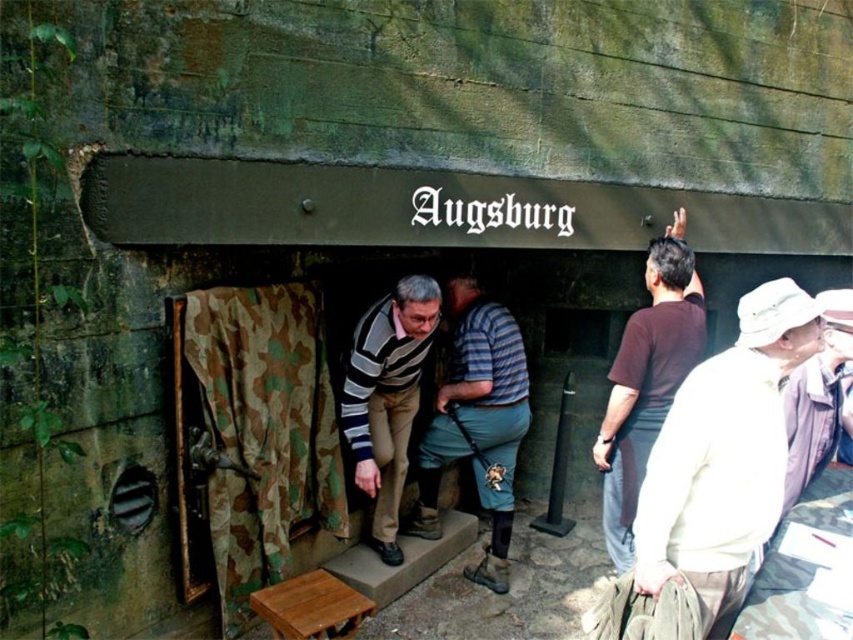
Question: Considering the relative positions of striped sweater at center and wooden stool at lower center in the image provided, where is striped sweater at center located with respect to wooden stool at lower center?

Choices:
 (A) above
 (B) below

Answer: (A)

Question: Which point is farther to the camera?

Choices:
 (A) white cotton hat at upper right
 (B) wooden stool at lower center
 (C) brown cotton shirt at upper right
 (D) camouflage fabric at center

Answer: (C)

Question: Which of the following is the closest to the observer?

Choices:
 (A) (741, 365)
 (B) (347, 592)
 (C) (502, 502)
 (D) (206, 320)

Answer: (A)

Question: Observing the image, what is the correct spatial positioning of white cotton hat at upper right in reference to brown cotton shirt at upper right?

Choices:
 (A) above
 (B) below

Answer: (B)

Question: Estimate the real-world distances between objects in this image. Which object is farther from the brown cotton shirt at upper right?

Choices:
 (A) striped sweater at center
 (B) camouflage fabric at center
 (C) striped cotton shirt at center
 (D) white cotton hat at upper right

Answer: (B)

Question: Where is camouflage fabric at center located in relation to wooden stool at lower center in the image?

Choices:
 (A) right
 (B) left

Answer: (B)